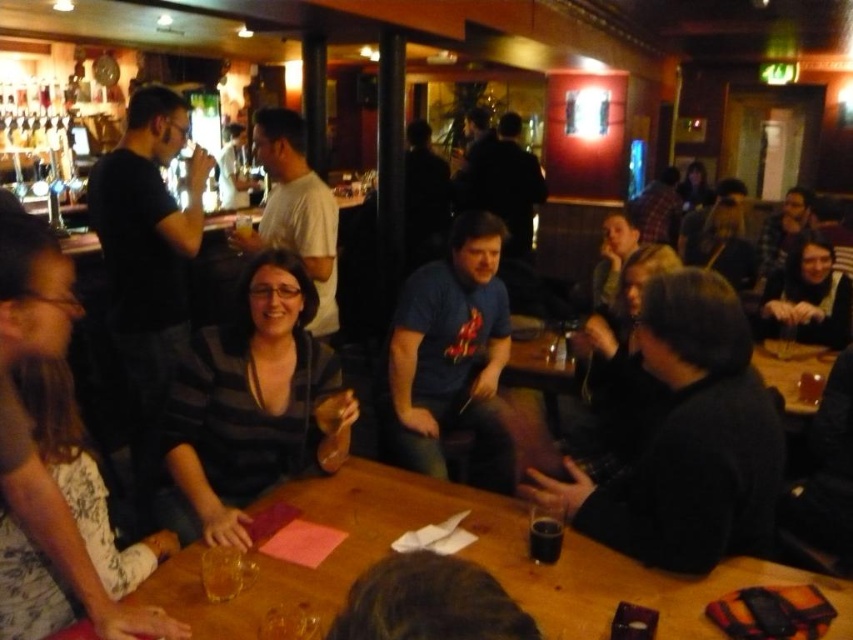
You are a person who wants to place a small book on the wooden table at center. However, you are wearing the black fuzzy jacket at right. Can you place the book on the table without removing the jacket?

The wooden table at center has a lesser height compared to black fuzzy jacket at right, so if you are wearing the jacket, you might need to bend down or adjust your posture to place the book on the table since the table is shorter than the jacket height.